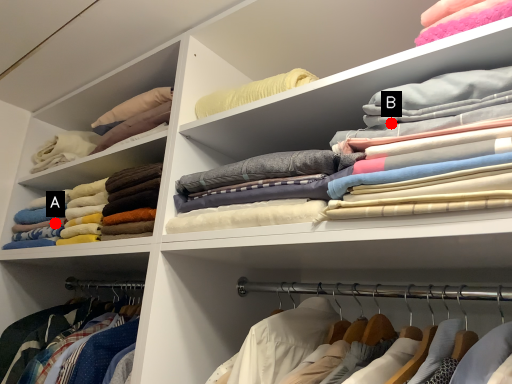
Question: Two points are circled on the image, labeled by A and B beside each circle. Which point is farther to the camera?

Choices:
 (A) A is further
 (B) B is further

Answer: (A)